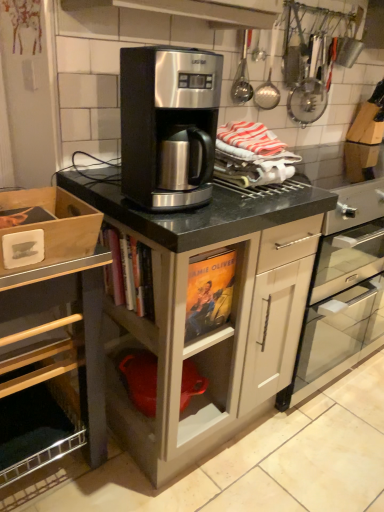
Image resolution: width=384 pixels, height=512 pixels. Describe the element at coordinates (53, 377) in the screenshot. I see `wooden box at left, marked as the second cabinetry in a right-to-left arrangement` at that location.

The image size is (384, 512). In order to click on wooden box at left, placed as the 1th cabinetry when sorted from left to right in this screenshot , I will do `click(53, 377)`.

This screenshot has height=512, width=384. I want to click on satin black coffee maker at center, so click(342, 293).

The image size is (384, 512). Describe the element at coordinates (208, 311) in the screenshot. I see `matte black coffee maker at center, which is the second cabinetry from left to right` at that location.

At what (x,y) coordinates should I click in order to perform the action: click on wooden box at left, marked as the second cabinetry in a right-to-left arrangement. Please return your answer as a coordinate pair (x, y). This screenshot has height=512, width=384. Looking at the image, I should click on (53, 377).

How different are the orientations of satin black coffee maker at center and wooden box at left, placed as the 1th cabinetry when sorted from left to right, in degrees?

1.82 degrees.

Considering their positions, is satin black coffee maker at center located in front of or behind wooden box at left, marked as the second cabinetry in a right-to-left arrangement?

Clearly, satin black coffee maker at center is behind wooden box at left, marked as the second cabinetry in a right-to-left arrangement.

From a real-world perspective, which object rests below the other?

wooden box at left, placed as the 1th cabinetry when sorted from left to right, from a real-world perspective.

Considering the sizes of objects satin black coffee maker at center and wooden box at left, placed as the 1th cabinetry when sorted from left to right, in the image provided, who is shorter, satin black coffee maker at center or wooden box at left, placed as the 1th cabinetry when sorted from left to right,?

Standing shorter between the two is satin black coffee maker at center.

Which of these two, satin black coffee maker at center or matte black coffee maker at center, marked as the 1th cabinetry in a right-to-left arrangement, is thinner?

matte black coffee maker at center, marked as the 1th cabinetry in a right-to-left arrangement, is thinner.

Between satin black coffee maker at center and matte black coffee maker at center, marked as the 1th cabinetry in a right-to-left arrangement, which one appears on the left side from the viewer's perspective?

From the viewer's perspective, matte black coffee maker at center, marked as the 1th cabinetry in a right-to-left arrangement, appears more on the left side.

Are satin black coffee maker at center and matte black coffee maker at center, marked as the 1th cabinetry in a right-to-left arrangement, making contact?

satin black coffee maker at center is not next to matte black coffee maker at center, marked as the 1th cabinetry in a right-to-left arrangement, and they're not touching.

Which object is positioned more to the right, matte black coffee maker at center, marked as the 1th cabinetry in a right-to-left arrangement, or stainless steel coffee maker at center?

matte black coffee maker at center, marked as the 1th cabinetry in a right-to-left arrangement.

Can you confirm if matte black coffee maker at center, marked as the 1th cabinetry in a right-to-left arrangement, is shorter than stainless steel coffee maker at center?

Incorrect, the height of matte black coffee maker at center, marked as the 1th cabinetry in a right-to-left arrangement, does not fall short of that of stainless steel coffee maker at center.

Considering their positions, is matte black coffee maker at center, which is the second cabinetry from left to right, located in front of or behind stainless steel coffee maker at center?

In the image, matte black coffee maker at center, which is the second cabinetry from left to right, appears behind stainless steel coffee maker at center.

From the image's perspective, which one is positioned lower, stainless steel coffee maker at center or wooden box at left, placed as the 1th cabinetry when sorted from left to right?

wooden box at left, placed as the 1th cabinetry when sorted from left to right, appears lower in the image.

Which is in front, stainless steel coffee maker at center or wooden box at left, marked as the second cabinetry in a right-to-left arrangement?

stainless steel coffee maker at center is in front.

Locate an element on the screen. kitchen appliance in front of the wooden box at left, placed as the 1th cabinetry when sorted from left to right is located at coordinates (168, 125).

Is stainless steel coffee maker at center not inside wooden box at left, marked as the second cabinetry in a right-to-left arrangement?

Yes, stainless steel coffee maker at center is not within wooden box at left, marked as the second cabinetry in a right-to-left arrangement.

Does satin black coffee maker at center have a lesser height compared to stainless steel coffee maker at center?

No.

From a real-world perspective, is satin black coffee maker at center physically above stainless steel coffee maker at center?

Actually, satin black coffee maker at center is physically below stainless steel coffee maker at center in the real world.

Could you tell me if satin black coffee maker at center is facing stainless steel coffee maker at center?

No, satin black coffee maker at center is not oriented towards stainless steel coffee maker at center.

In the scene shown: Is satin black coffee maker at center at the back of wooden box at left, marked as the second cabinetry in a right-to-left arrangement?

wooden box at left, marked as the second cabinetry in a right-to-left arrangement, is not turned away from satin black coffee maker at center.

Can satin black coffee maker at center be found inside wooden box at left, placed as the 1th cabinetry when sorted from left to right?

Actually, satin black coffee maker at center is outside wooden box at left, placed as the 1th cabinetry when sorted from left to right.

In the scene shown: Between wooden box at left, marked as the second cabinetry in a right-to-left arrangement, and satin black coffee maker at center, which one appears on the left side from the viewer's perspective?

wooden box at left, marked as the second cabinetry in a right-to-left arrangement.

Identify the location of the 2nd cabinetry to the left of the satin black coffee maker at center, starting your count from the anchor. (53, 377).

Is wooden box at left, marked as the second cabinetry in a right-to-left arrangement, taller than stainless steel coffee maker at center?

Yes, wooden box at left, marked as the second cabinetry in a right-to-left arrangement, is taller than stainless steel coffee maker at center.

Who is bigger, wooden box at left, placed as the 1th cabinetry when sorted from left to right, or stainless steel coffee maker at center?

Bigger between the two is wooden box at left, placed as the 1th cabinetry when sorted from left to right.

From a real-world perspective, is wooden box at left, placed as the 1th cabinetry when sorted from left to right, located beneath stainless steel coffee maker at center?

Indeed, from a real-world perspective, wooden box at left, placed as the 1th cabinetry when sorted from left to right, is positioned beneath stainless steel coffee maker at center.

Is wooden box at left, marked as the second cabinetry in a right-to-left arrangement, wider than stainless steel coffee maker at center?

Correct, the width of wooden box at left, marked as the second cabinetry in a right-to-left arrangement, exceeds that of stainless steel coffee maker at center.

In the image, there is a satin black coffee maker at center. In order to click on cabinetry below it (from a real-world perspective) in this screenshot , I will do `click(53, 377)`.

In the image, there is a matte black coffee maker at center, which is the second cabinetry from left to right. At what (x,y) coordinates should I click in order to perform the action: click on home appliance above it (from the image's perspective). Please return your answer as a coordinate pair (x, y). Looking at the image, I should click on (342, 293).

Considering their positions, is stainless steel coffee maker at center positioned closer to matte black coffee maker at center, marked as the 1th cabinetry in a right-to-left arrangement, than wooden box at left, marked as the second cabinetry in a right-to-left arrangement?

wooden box at left, marked as the second cabinetry in a right-to-left arrangement.

From the image, which object appears to be farther from wooden box at left, marked as the second cabinetry in a right-to-left arrangement, matte black coffee maker at center, marked as the 1th cabinetry in a right-to-left arrangement, or stainless steel coffee maker at center?

stainless steel coffee maker at center is positioned further to the anchor wooden box at left, marked as the second cabinetry in a right-to-left arrangement.

From the image, which object appears to be farther from satin black coffee maker at center, stainless steel coffee maker at center or wooden box at left, marked as the second cabinetry in a right-to-left arrangement?

Based on the image, wooden box at left, marked as the second cabinetry in a right-to-left arrangement, appears to be further to satin black coffee maker at center.

From the image, which object appears to be farther from stainless steel coffee maker at center, wooden box at left, marked as the second cabinetry in a right-to-left arrangement, or matte black coffee maker at center, marked as the 1th cabinetry in a right-to-left arrangement?

wooden box at left, marked as the second cabinetry in a right-to-left arrangement, lies further to stainless steel coffee maker at center than the other object.

Based on the photo, when comparing their distances from stainless steel coffee maker at center, does satin black coffee maker at center or matte black coffee maker at center, which is the second cabinetry from left to right, seem further?

satin black coffee maker at center.

In the scene shown: Based on their spatial positions, is satin black coffee maker at center or stainless steel coffee maker at center closer to matte black coffee maker at center, marked as the 1th cabinetry in a right-to-left arrangement?

stainless steel coffee maker at center lies closer to matte black coffee maker at center, marked as the 1th cabinetry in a right-to-left arrangement, than the other object.

Looking at the image, which one is located further to wooden box at left, placed as the 1th cabinetry when sorted from left to right, matte black coffee maker at center, marked as the 1th cabinetry in a right-to-left arrangement, or satin black coffee maker at center?

Among the two, satin black coffee maker at center is located further to wooden box at left, placed as the 1th cabinetry when sorted from left to right.

Looking at the image, which one is located further to stainless steel coffee maker at center, satin black coffee maker at center or wooden box at left, placed as the 1th cabinetry when sorted from left to right?

satin black coffee maker at center is further to stainless steel coffee maker at center.

Identify the location of kitchen appliance situated between wooden box at left, marked as the second cabinetry in a right-to-left arrangement, and matte black coffee maker at center, which is the second cabinetry from left to right, from left to right. (168, 125).

The height and width of the screenshot is (512, 384). I want to click on cabinetry between wooden box at left, placed as the 1th cabinetry when sorted from left to right, and satin black coffee maker at center from left to right, so click(208, 311).

In order to click on cabinetry between stainless steel coffee maker at center and satin black coffee maker at center in the horizontal direction in this screenshot , I will do `click(208, 311)`.

I want to click on kitchen appliance situated between wooden box at left, placed as the 1th cabinetry when sorted from left to right, and satin black coffee maker at center from left to right, so click(168, 125).